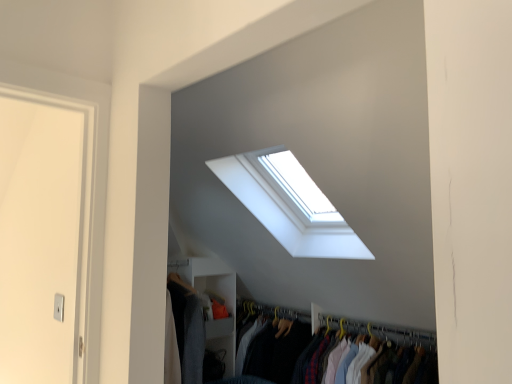
Question: Considering the positions of yellow plastic hanger at upper center and white fabric clothes at center, arranged as the first closet when viewed from the front, in the image, is yellow plastic hanger at upper center wider or thinner than white fabric clothes at center, arranged as the first closet when viewed from the front,?

Choices:
 (A) wide
 (B) thin

Answer: (B)

Question: From a real-world perspective, is yellow plastic hanger at upper center positioned above or below white fabric clothes at center, the first closet from the right?

Choices:
 (A) below
 (B) above

Answer: (B)

Question: Based on their relative distances, which object is farther from the white glass window at upper center?

Choices:
 (A) yellow plastic hanger at upper center
 (B) white fabric clothes at center, the first closet from the right
 (C) white matte closet at lower left, the first closet viewed from the left

Answer: (C)

Question: Based on their relative distances, which object is farther from the yellow plastic hanger at upper center?

Choices:
 (A) white glass window at upper center
 (B) white matte closet at lower left, which is counted as the second closet, starting from the right
 (C) white fabric clothes at center, the first closet from the right

Answer: (A)